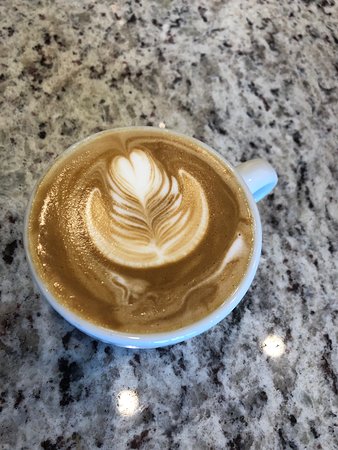
Find the location of `foam`. foam is located at coordinates (224, 280), (247, 212), (232, 178).